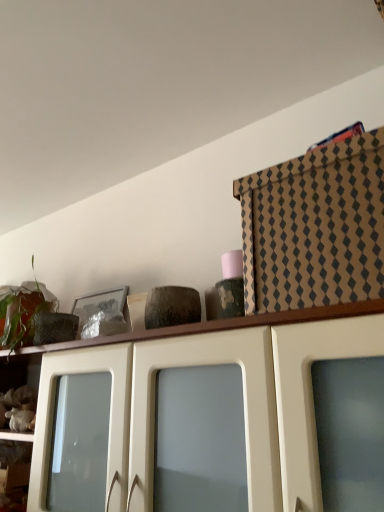
This screenshot has height=512, width=384. What do you see at coordinates (22, 312) in the screenshot?
I see `green matte plant at upper left` at bounding box center [22, 312].

Locate an element on the screen. brown cardboard box at upper right, placed as the 2th cabinetry when sorted from bottom to top is located at coordinates (315, 227).

Is matte white cabinet at upper center, positioned as the 1th cabinetry in bottom-to-top order, completely or partially inside green matte plant at upper left?

Actually, matte white cabinet at upper center, positioned as the 1th cabinetry in bottom-to-top order, is outside green matte plant at upper left.

Does green matte plant at upper left lie in front of matte white cabinet at upper center, arranged as the second cabinetry when viewed from the top?

No, it is behind matte white cabinet at upper center, arranged as the second cabinetry when viewed from the top.

Is green matte plant at upper left bigger than matte white cabinet at upper center, positioned as the 1th cabinetry in bottom-to-top order?

No, green matte plant at upper left is not bigger than matte white cabinet at upper center, positioned as the 1th cabinetry in bottom-to-top order.

At what (x,y) coordinates should I click in order to perform the action: click on cabinetry below the green matte plant at upper left (from a real-world perspective). Please return your answer as a coordinate pair (x, y). Image resolution: width=384 pixels, height=512 pixels. Looking at the image, I should click on (221, 337).

From a real-world perspective, does brown cardboard box at upper right, which ranks as the 1th cabinetry in top-to-bottom order, stand above matte white cabinet at upper center, arranged as the second cabinetry when viewed from the top?

Yes, from a real-world perspective, brown cardboard box at upper right, which ranks as the 1th cabinetry in top-to-bottom order, is over matte white cabinet at upper center, arranged as the second cabinetry when viewed from the top

Does brown cardboard box at upper right, which ranks as the 1th cabinetry in top-to-bottom order, lie in front of matte white cabinet at upper center, positioned as the 1th cabinetry in bottom-to-top order?

No.

Which object is positioned more to the right, brown cardboard box at upper right, which ranks as the 1th cabinetry in top-to-bottom order, or matte white cabinet at upper center, arranged as the second cabinetry when viewed from the top?

brown cardboard box at upper right, which ranks as the 1th cabinetry in top-to-bottom order, is more to the right.

Considering the points (284, 175) and (274, 431), which point is behind, point (284, 175) or point (274, 431)?

Positioned behind is point (284, 175).

Which of these two, brown cardboard box at upper right, which ranks as the 1th cabinetry in top-to-bottom order, or green matte plant at upper left, is thinner?

Thinner between the two is green matte plant at upper left.

Are brown cardboard box at upper right, which ranks as the 1th cabinetry in top-to-bottom order, and green matte plant at upper left located far from each other?

Actually, brown cardboard box at upper right, which ranks as the 1th cabinetry in top-to-bottom order, and green matte plant at upper left are a little close together.

Is brown cardboard box at upper right, which ranks as the 1th cabinetry in top-to-bottom order, inside or outside of green matte plant at upper left?

brown cardboard box at upper right, which ranks as the 1th cabinetry in top-to-bottom order, exists outside the volume of green matte plant at upper left.

In the image, is brown cardboard box at upper right, placed as the 2th cabinetry when sorted from bottom to top, positioned in front of or behind green matte plant at upper left?

In the image, brown cardboard box at upper right, placed as the 2th cabinetry when sorted from bottom to top, appears in front of green matte plant at upper left.

Choose the correct answer: Is matte white cabinet at upper center, arranged as the second cabinetry when viewed from the top, inside green matte plant at upper left or outside it?

matte white cabinet at upper center, arranged as the second cabinetry when viewed from the top, is not inside green matte plant at upper left, it's outside.

Does matte white cabinet at upper center, positioned as the 1th cabinetry in bottom-to-top order, turn towards green matte plant at upper left?

No, matte white cabinet at upper center, positioned as the 1th cabinetry in bottom-to-top order, is not facing towards green matte plant at upper left.

From the image's perspective, is matte white cabinet at upper center, positioned as the 1th cabinetry in bottom-to-top order, below green matte plant at upper left?

Yes, from the image's perspective, matte white cabinet at upper center, positioned as the 1th cabinetry in bottom-to-top order, is beneath green matte plant at upper left.

Considering the relative positions of matte white cabinet at upper center, positioned as the 1th cabinetry in bottom-to-top order, and green matte plant at upper left in the image provided, is matte white cabinet at upper center, positioned as the 1th cabinetry in bottom-to-top order, to the right of green matte plant at upper left from the viewer's perspective?

Yes, matte white cabinet at upper center, positioned as the 1th cabinetry in bottom-to-top order, is to the right of green matte plant at upper left.

Which point is more forward, [12,309] or [343,192]?

The point [343,192] is more forward.

Between green matte plant at upper left and brown cardboard box at upper right, which ranks as the 1th cabinetry in top-to-bottom order, which one has smaller width?

Thinner between the two is green matte plant at upper left.

Who is taller, green matte plant at upper left or brown cardboard box at upper right, placed as the 2th cabinetry when sorted from bottom to top?

Standing taller between the two is green matte plant at upper left.

Is matte white cabinet at upper center, positioned as the 1th cabinetry in bottom-to-top order, beside brown cardboard box at upper right, placed as the 2th cabinetry when sorted from bottom to top?

No, matte white cabinet at upper center, positioned as the 1th cabinetry in bottom-to-top order, is not making contact with brown cardboard box at upper right, placed as the 2th cabinetry when sorted from bottom to top.

From a real-world perspective, which is physically below, matte white cabinet at upper center, positioned as the 1th cabinetry in bottom-to-top order, or brown cardboard box at upper right, which ranks as the 1th cabinetry in top-to-bottom order?

matte white cabinet at upper center, positioned as the 1th cabinetry in bottom-to-top order, is physically lower.

From the image's perspective, is matte white cabinet at upper center, arranged as the second cabinetry when viewed from the top, above brown cardboard box at upper right, placed as the 2th cabinetry when sorted from bottom to top?

No.

Does matte white cabinet at upper center, positioned as the 1th cabinetry in bottom-to-top order, turn towards brown cardboard box at upper right, placed as the 2th cabinetry when sorted from bottom to top?

No, matte white cabinet at upper center, positioned as the 1th cabinetry in bottom-to-top order, is not oriented towards brown cardboard box at upper right, placed as the 2th cabinetry when sorted from bottom to top.

Locate an element on the screen. plant behind the matte white cabinet at upper center, positioned as the 1th cabinetry in bottom-to-top order is located at coordinates (22, 312).

Where is `cabinetry below the brown cardboard box at upper right, placed as the 2th cabinetry when sorted from bottom to top (from the image's perspective)`? Image resolution: width=384 pixels, height=512 pixels. cabinetry below the brown cardboard box at upper right, placed as the 2th cabinetry when sorted from bottom to top (from the image's perspective) is located at coordinates (221, 337).

From the image, which object appears to be farther from matte white cabinet at upper center, arranged as the second cabinetry when viewed from the top, green matte plant at upper left or brown cardboard box at upper right, placed as the 2th cabinetry when sorted from bottom to top?

green matte plant at upper left is positioned further to the anchor matte white cabinet at upper center, arranged as the second cabinetry when viewed from the top.

From the image, which object appears to be nearer to brown cardboard box at upper right, placed as the 2th cabinetry when sorted from bottom to top, matte white cabinet at upper center, arranged as the second cabinetry when viewed from the top, or green matte plant at upper left?

matte white cabinet at upper center, arranged as the second cabinetry when viewed from the top, is positioned closer to the anchor brown cardboard box at upper right, placed as the 2th cabinetry when sorted from bottom to top.

Which object lies further to the anchor point brown cardboard box at upper right, placed as the 2th cabinetry when sorted from bottom to top, green matte plant at upper left or matte white cabinet at upper center, positioned as the 1th cabinetry in bottom-to-top order?

Among the two, green matte plant at upper left is located further to brown cardboard box at upper right, placed as the 2th cabinetry when sorted from bottom to top.

Considering their positions, is matte white cabinet at upper center, positioned as the 1th cabinetry in bottom-to-top order, positioned further to green matte plant at upper left than brown cardboard box at upper right, placed as the 2th cabinetry when sorted from bottom to top?

Based on the image, brown cardboard box at upper right, placed as the 2th cabinetry when sorted from bottom to top, appears to be further to green matte plant at upper left.

When comparing their distances from green matte plant at upper left, does brown cardboard box at upper right, which ranks as the 1th cabinetry in top-to-bottom order, or matte white cabinet at upper center, arranged as the second cabinetry when viewed from the top, seem further?

brown cardboard box at upper right, which ranks as the 1th cabinetry in top-to-bottom order, lies further to green matte plant at upper left than the other object.

From the image, which object appears to be farther from matte white cabinet at upper center, positioned as the 1th cabinetry in bottom-to-top order, brown cardboard box at upper right, which ranks as the 1th cabinetry in top-to-bottom order, or green matte plant at upper left?

Based on the image, green matte plant at upper left appears to be further to matte white cabinet at upper center, positioned as the 1th cabinetry in bottom-to-top order.

Identify the location of cabinetry between green matte plant at upper left and brown cardboard box at upper right, placed as the 2th cabinetry when sorted from bottom to top. Image resolution: width=384 pixels, height=512 pixels. (221, 337).